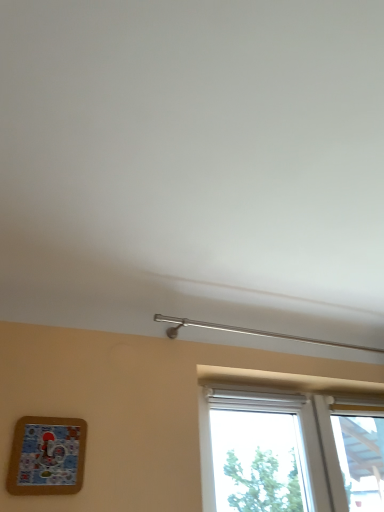
Question: Is corkboard at lower left wider or thinner than white plastic window at lower right?

Choices:
 (A) thin
 (B) wide

Answer: (A)

Question: From a real-world perspective, is corkboard at lower left physically located above or below white plastic window at lower right?

Choices:
 (A) below
 (B) above

Answer: (A)

Question: Is corkboard at lower left taller or shorter than white plastic window at lower right?

Choices:
 (A) tall
 (B) short

Answer: (B)

Question: From a real-world perspective, relative to corkboard at lower left, is white plastic window at lower right vertically above or below?

Choices:
 (A) below
 (B) above

Answer: (B)

Question: Considering the relative positions of white plastic window at lower right and corkboard at lower left in the image provided, is white plastic window at lower right to the left or to the right of corkboard at lower left?

Choices:
 (A) right
 (B) left

Answer: (A)

Question: Looking at the image, does white plastic window at lower right seem bigger or smaller compared to corkboard at lower left?

Choices:
 (A) small
 (B) big

Answer: (B)

Question: In the image, is white plastic window at lower right positioned in front of or behind corkboard at lower left?

Choices:
 (A) front
 (B) behind

Answer: (B)